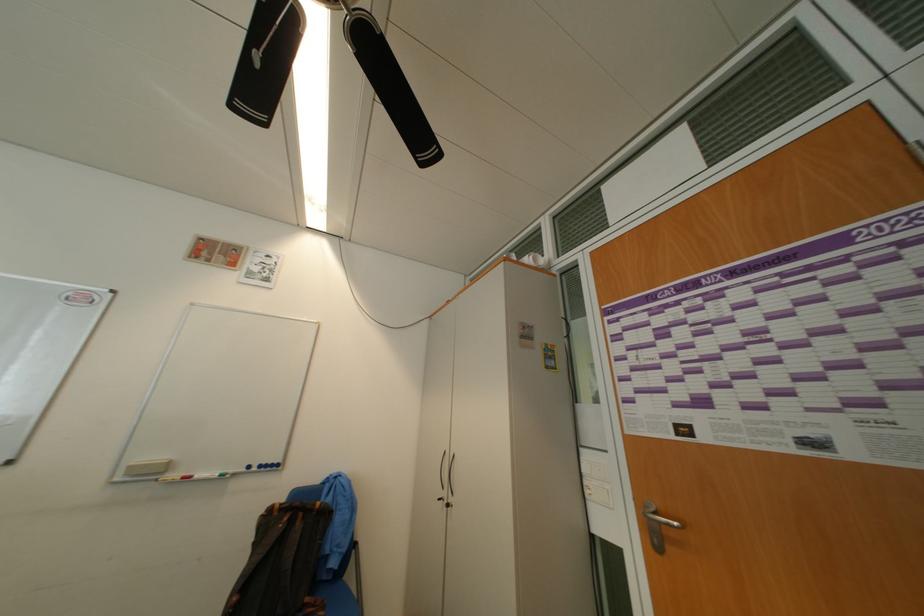
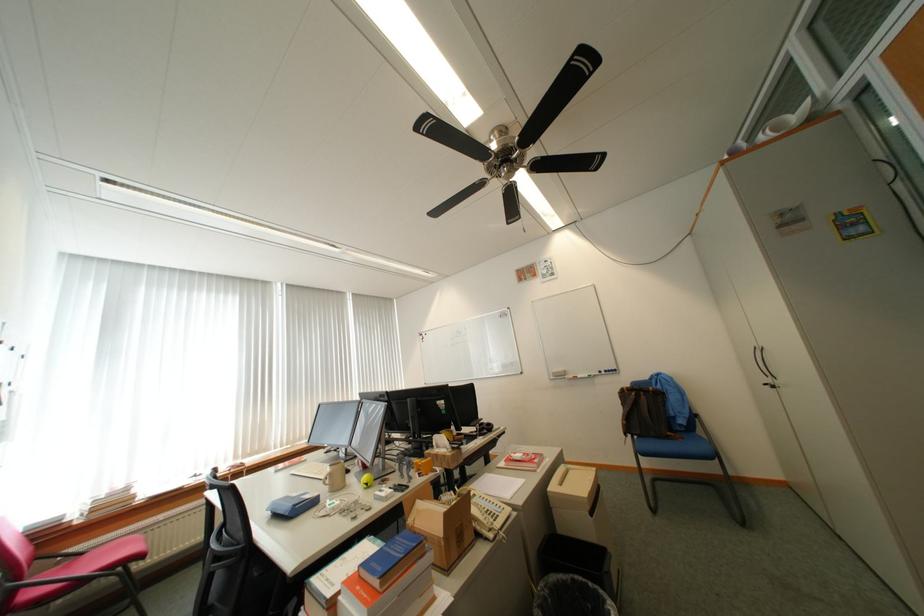
Question: How did the camera likely rotate?

Choices:
 (A) Left
 (B) Right
 (C) Up
 (D) Down

Answer: (A)